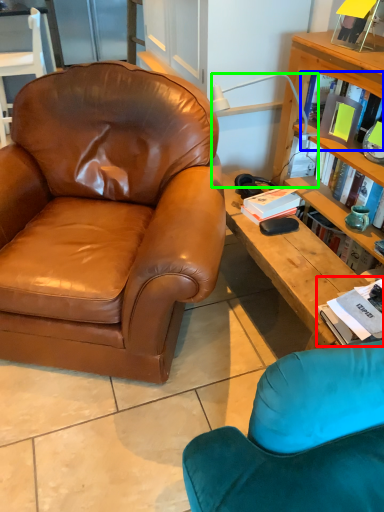
Question: Based on their relative distances, which object is farther from book (highlighted by a red box)? Choose from book (highlighted by a blue box) and lamp (highlighted by a green box).

Choices:
 (A) book
 (B) lamp

Answer: (B)